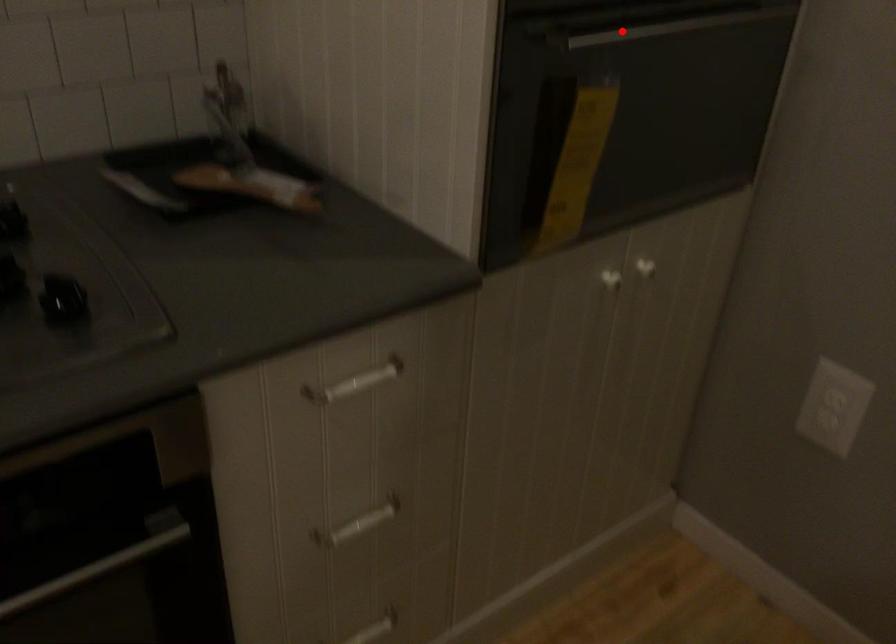
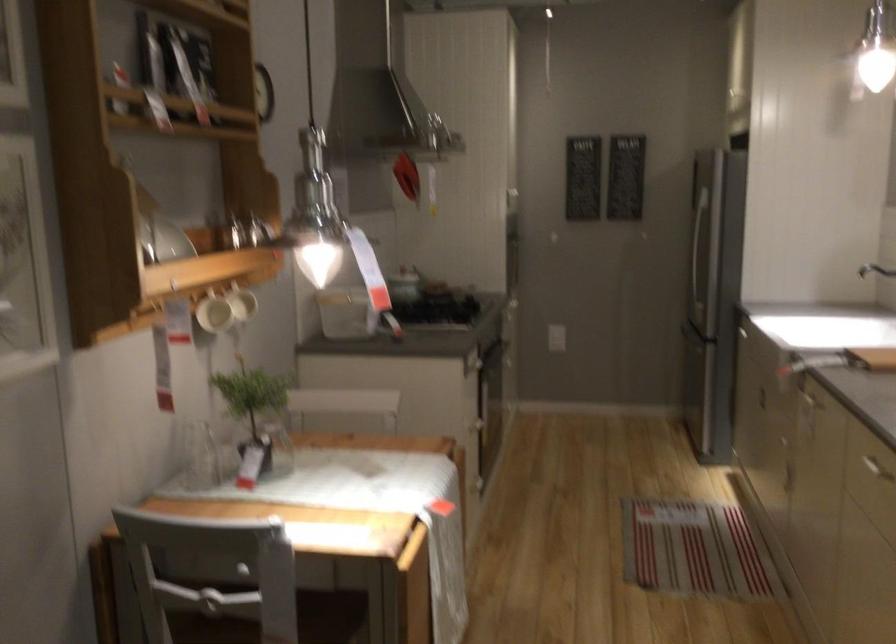
Question: I am providing you with two images of the same scene from different viewpoints. A red point is marked on the first image. At the location where the point appears in image 1, is it still visible in image 2?

Choices:
 (A) Yes
 (B) No

Answer: (B)